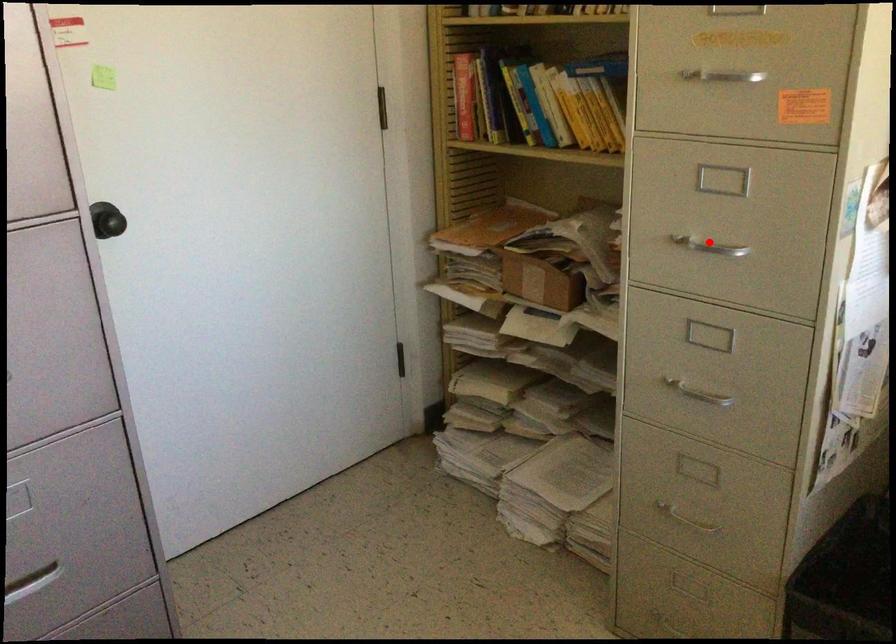
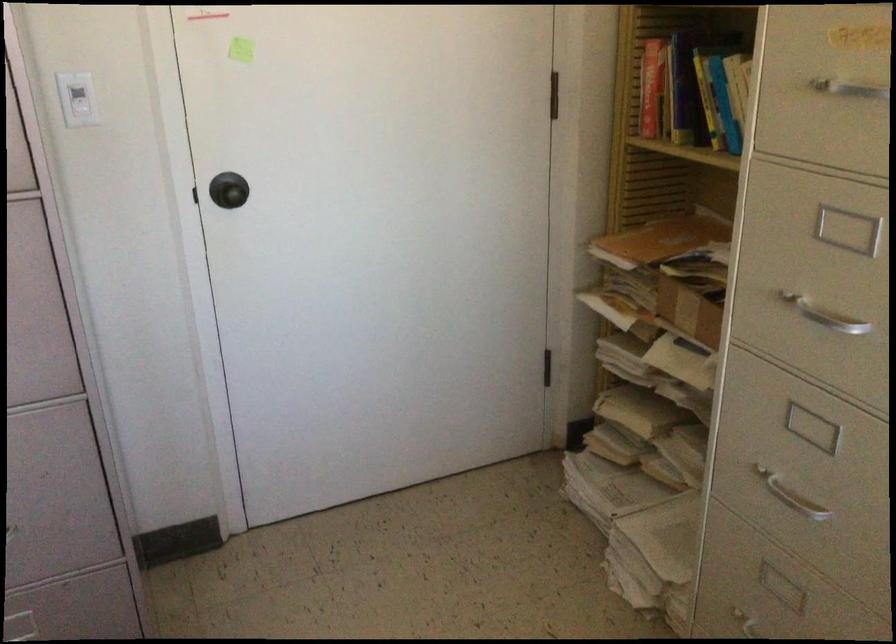
In the second image, find the point that corresponds to the highlighted location in the first image.

(824, 315)